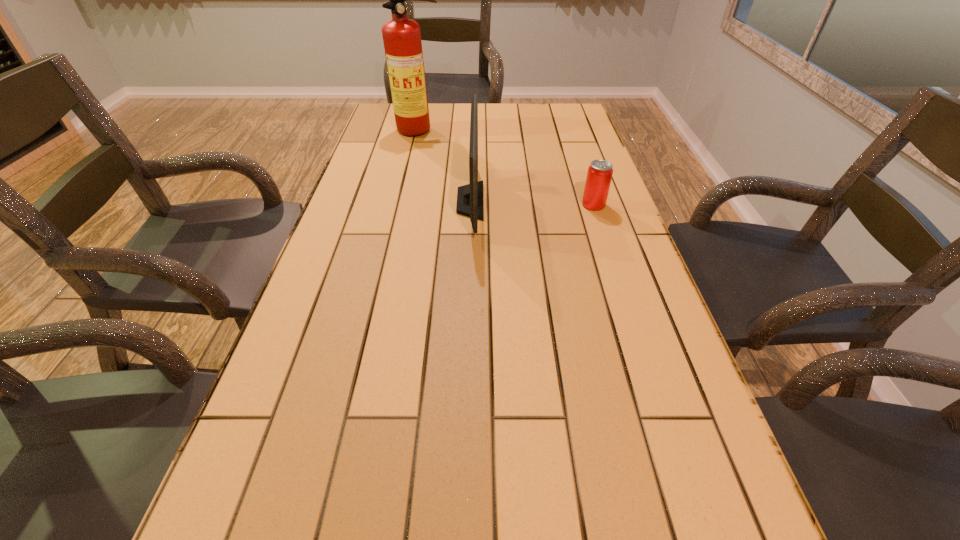
Identify the location of the tallest object. (402, 42).

You are a GUI agent. You are given a task and a screenshot of the screen. Output one action in this format:
    pyautogui.click(x=<x>, y=<y>)
    Task: Click on the fire extinguisher
    This screenshot has height=540, width=960.
    Given the screenshot: What is the action you would take?
    pyautogui.click(x=402, y=42)

Where is `the second tallest object`? The width and height of the screenshot is (960, 540). the second tallest object is located at coordinates (469, 197).

This screenshot has width=960, height=540. What are the coordinates of `monitor` in the screenshot? It's located at (469, 197).

At what (x,y) coordinates should I click in order to perform the action: click on can. Please return your answer as a coordinate pair (x, y). This screenshot has width=960, height=540. Looking at the image, I should click on (599, 175).

Image resolution: width=960 pixels, height=540 pixels. What are the coordinates of `the shortest object` in the screenshot? It's located at (599, 175).

Locate an element on the screen. vacant area located on the front-facing side of the tallest object is located at coordinates (403, 202).

At what (x,y) coordinates should I click in order to perform the action: click on free point located 0.320m on the screen side of the monitor. Please return your answer as a coordinate pair (x, y). This screenshot has height=540, width=960. Looking at the image, I should click on coord(596,201).

Find the location of a particular element. vacant space positioned 0.350m on the back of the rightmost object is located at coordinates (573, 143).

Where is `object present at the far edge`? object present at the far edge is located at coordinates (402, 42).